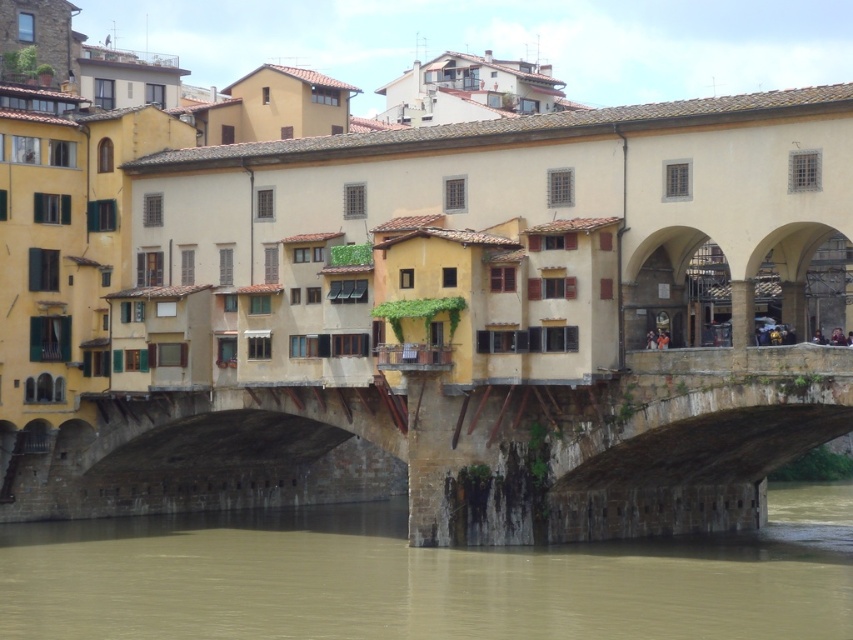
You are a tourist standing at the starting point of the bridge and want to reach the end of the stone bridge at center. What direction should you move in to reach the end?

Since the stone bridge at center is positioned at point 0.705 on the x axis and 0.547 on the y axis, you should move towards the right direction to reach the end of the stone bridge at center.